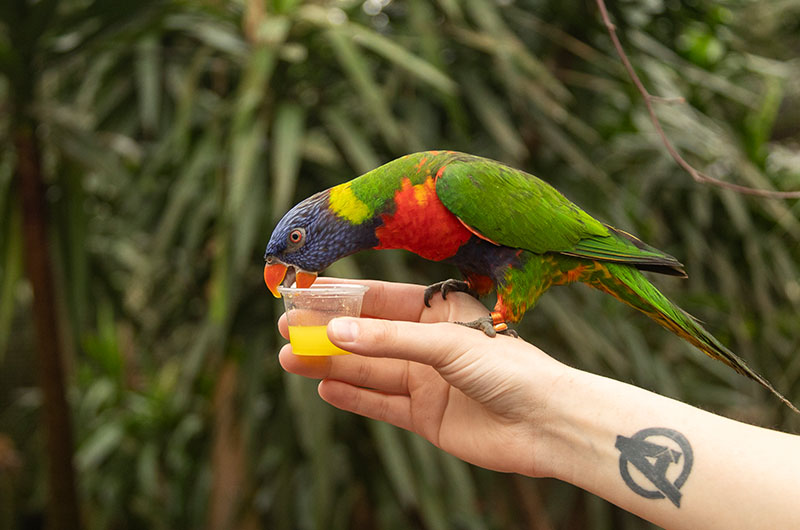
The image size is (800, 530). What are the coordinates of `cup` in the screenshot? It's located at (312, 322).